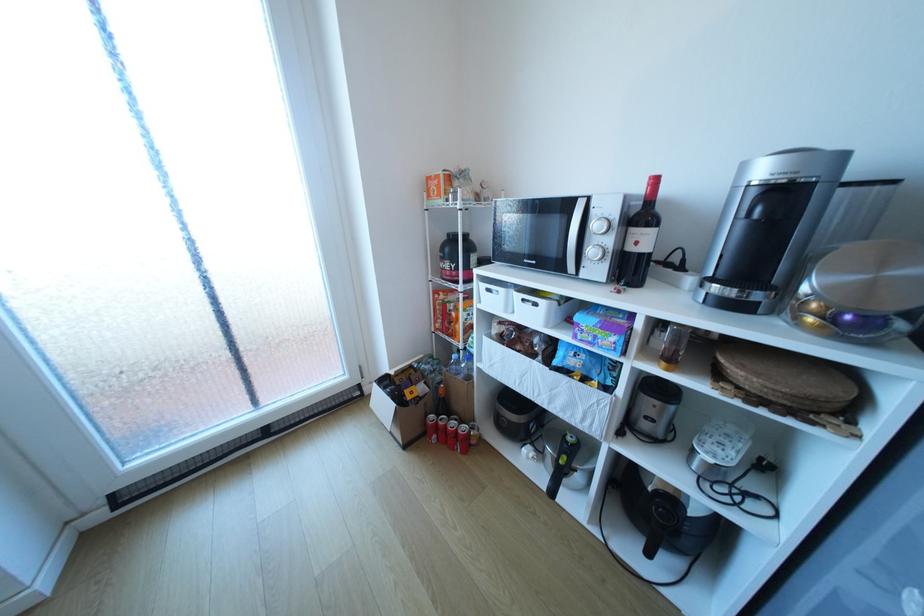
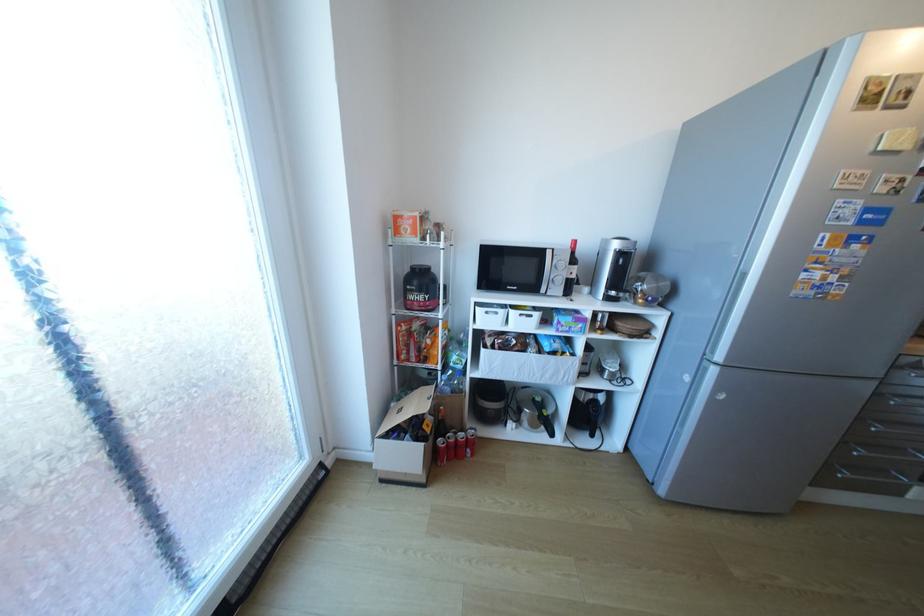
Find the pixel in the second image that matches pixel 465 529 in the first image.

(523, 504)